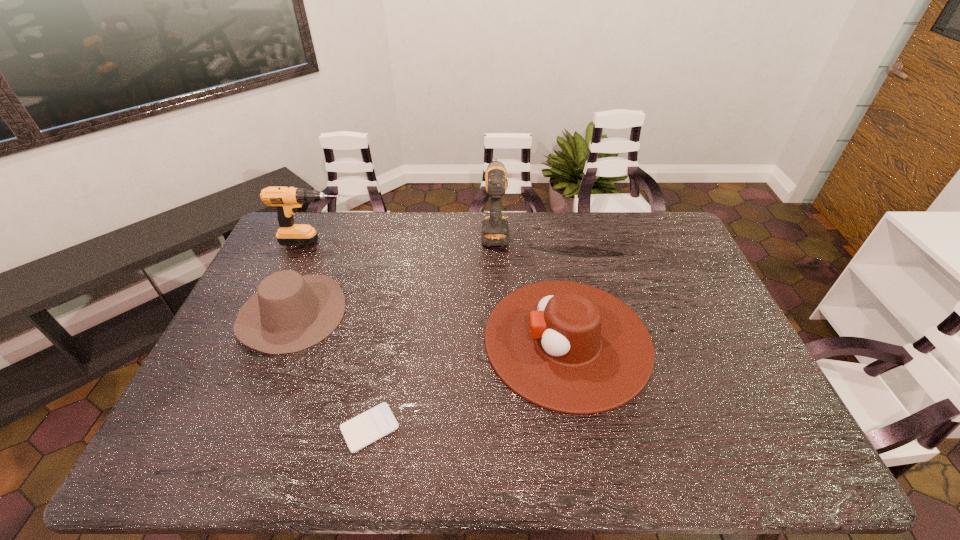
At what (x,y) coordinates should I click in order to perform the action: click on the taller drill. Please return your answer as a coordinate pair (x, y). The height and width of the screenshot is (540, 960). Looking at the image, I should click on (495, 232).

Locate an element on the screen. This screenshot has height=540, width=960. the tallest object is located at coordinates (495, 232).

The image size is (960, 540). I want to click on the shorter drill, so click(286, 200).

Identify the location of the second tallest object. The image size is (960, 540). (286, 200).

This screenshot has width=960, height=540. In order to click on the right cowboy hat in this screenshot , I will do `click(568, 347)`.

Where is `the left cowboy hat`? The height and width of the screenshot is (540, 960). the left cowboy hat is located at coordinates click(289, 313).

At what (x,y) coordinates should I click in order to perform the action: click on calculator. Please return your answer as a coordinate pair (x, y). Looking at the image, I should click on coord(364,429).

Locate an element on the screen. The height and width of the screenshot is (540, 960). the shortest object is located at coordinates (364, 429).

Locate an element on the screen. vacant area situated at the tip of the left drill is located at coordinates (378, 242).

Identify the location of free space located on the front-facing side of the right cowboy hat. This screenshot has height=540, width=960. (x=370, y=340).